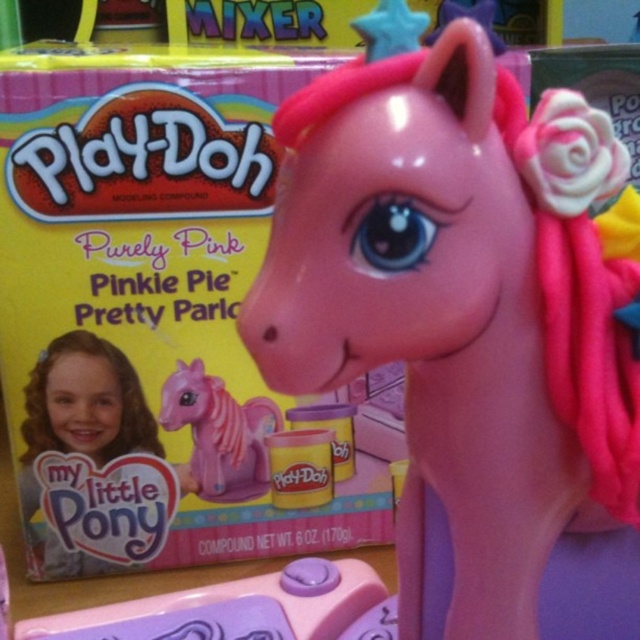
You are looking at the Play Doh toy set box for the Purely Pink Pinkie Pie Pretty Parlour. On the packaging, where is the glossy plastic pony at center positioned relative to the Play Doh logo displayed at the top left corner?

The glossy plastic pony at center is located at point (467, 323), which is below and to the right of the Play Doh logo at the top left corner.

Where is the glossy plastic pony at center located on the image?

The glossy plastic pony at center is located at point coordinates of (467,323).

You are a child trying to decide which pony to choose for a game. Both the glossy plastic pony at center and the pink matte plastic pony at center are in front of you. Which one is taller?

The glossy plastic pony at center is taller than the pink matte plastic pony at center according to the description.